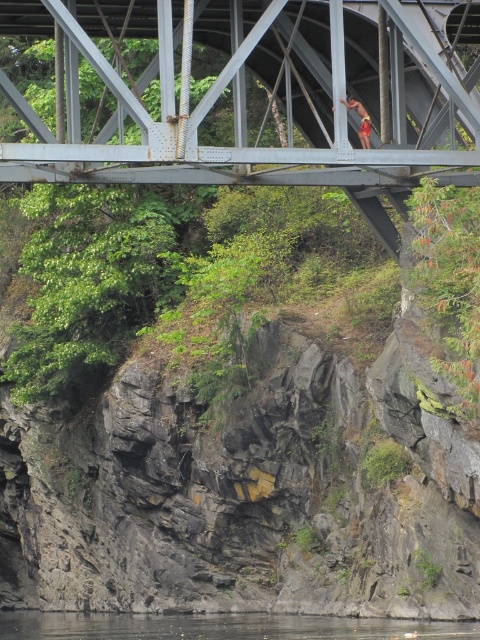
Is metallic gray bridge at center to the left of clear water at lower center from the viewer's perspective?

Incorrect, metallic gray bridge at center is not on the left side of clear water at lower center.

Is metallic gray bridge at center below clear water at lower center?

Actually, metallic gray bridge at center is above clear water at lower center.

Does point (35, 122) come closer to viewer compared to point (173, 616)?

Yes, point (35, 122) is closer to viewer.

Locate an element on the screen. Image resolution: width=480 pixels, height=640 pixels. metallic gray bridge at center is located at coordinates (244, 99).

Is metallic gray bridge at center bigger than camouflage shorts at center?

Indeed, metallic gray bridge at center has a larger size compared to camouflage shorts at center.

From the picture: Who is more distant from viewer, (x=128, y=147) or (x=361, y=131)?

Positioned behind is point (x=361, y=131).

Find the location of a particular element. The height and width of the screenshot is (640, 480). metallic gray bridge at center is located at coordinates point(244,99).

Can you confirm if clear water at lower center is bigger than camouflage shorts at center?

Correct, clear water at lower center is larger in size than camouflage shorts at center.

Which is in front, point (328, 632) or point (365, 125)?

Positioned in front is point (365, 125).

Between point (12, 634) and point (360, 113), which one is positioned in front?

Positioned in front is point (360, 113).

Find the location of a particular element. The height and width of the screenshot is (640, 480). clear water at lower center is located at coordinates (219, 627).